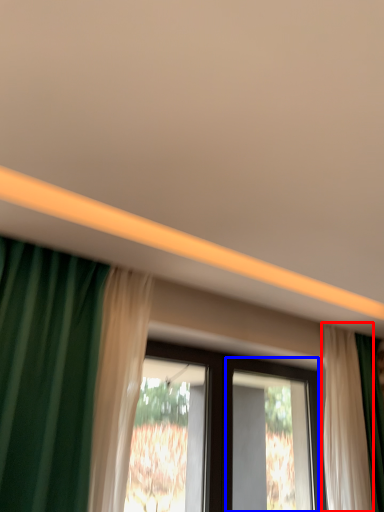
Question: Which object is further to the camera taking this photo, curtain (highlighted by a red box) or screen door (highlighted by a blue box)?

Choices:
 (A) curtain
 (B) screen door

Answer: (A)